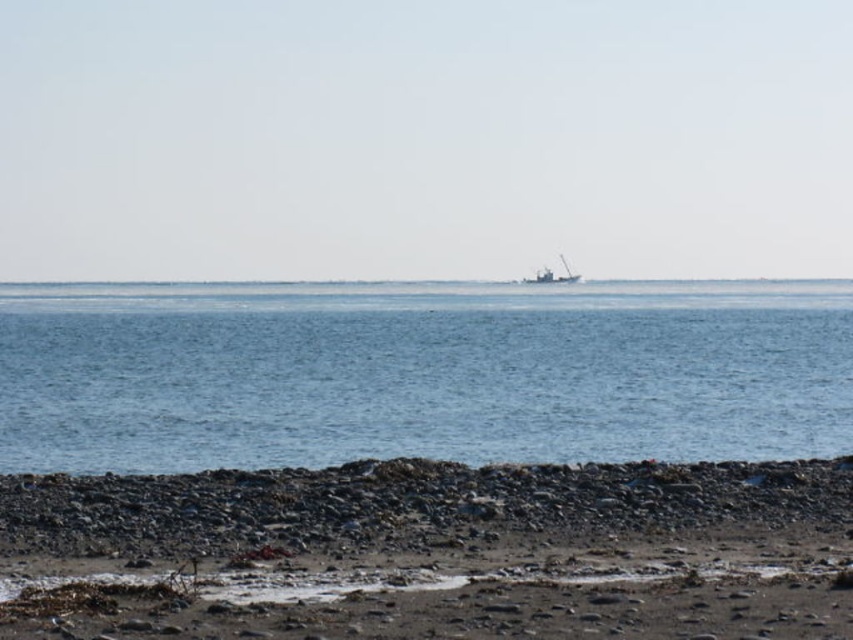
From the picture: You are standing on the rocky beach and want to walk towards the blue water at center. Which direction should you head relative to the smooth pebbles at lower center?

You should head to the left of the smooth pebbles at lower center because the blue water at center is located to the left of them.

You are standing on the rocky beach in the foreground of the image. You see a point marked at coordinates (x=421, y=372). Based on the scene description, where is this point located?

The point at coordinates (x=421, y=372) is on the blue water at center, so it is located in the middle ground where the calm blue water stretches out towards the horizon.

You are a photographer setting up a tripod on the rocky beach. You want to place your equipment between the smooth pebbles at lower center and the metallic gray boat at center. Given that your tripod requires a space of 1.2 meters, can you fit it there?

The smooth pebbles at lower center are wider than the metallic gray boat at center. However, the exact distance between them isn not specified in the provided description. Without knowing the actual spacing between the two objects, it is impossible to determine if the tripod will fit.